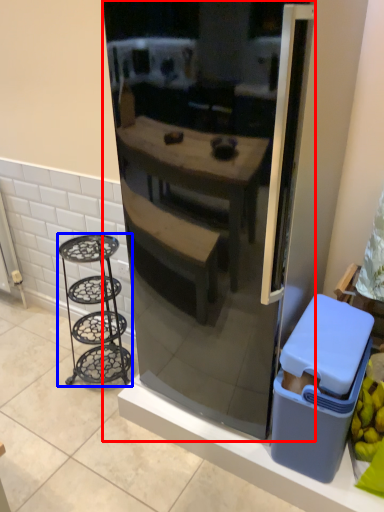
Question: Which of the following is the farthest to the observer, refrigerator (highlighted by a red box) or furniture (highlighted by a blue box)?

Choices:
 (A) refrigerator
 (B) furniture

Answer: (B)